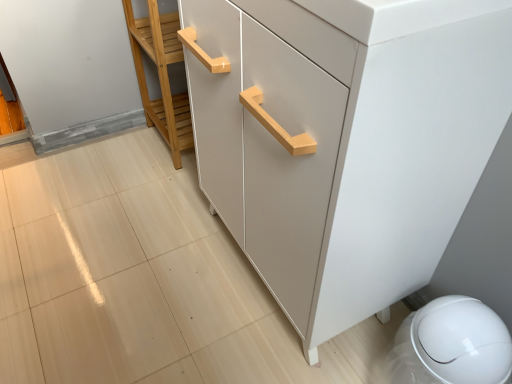
Question: Is light wood cabinet handle at center wider or thinner than matte white cabinet at center?

Choices:
 (A) thin
 (B) wide

Answer: (A)

Question: From a real-world perspective, is light wood cabinet handle at center above or below matte white cabinet at center?

Choices:
 (A) above
 (B) below

Answer: (B)

Question: Visually, is light wood cabinet handle at center positioned to the left or to the right of matte white cabinet at center?

Choices:
 (A) right
 (B) left

Answer: (B)

Question: Visually, is matte white cabinet at center positioned to the left or to the right of light wood cabinet handle at center?

Choices:
 (A) right
 (B) left

Answer: (A)

Question: From the image's perspective, relative to light wood cabinet handle at center, is matte white cabinet at center above or below?

Choices:
 (A) below
 (B) above

Answer: (A)

Question: Is matte white cabinet at center wider or thinner than light wood cabinet handle at center?

Choices:
 (A) thin
 (B) wide

Answer: (B)

Question: Does point (434, 9) appear closer or farther from the camera than point (159, 49)?

Choices:
 (A) farther
 (B) closer

Answer: (B)